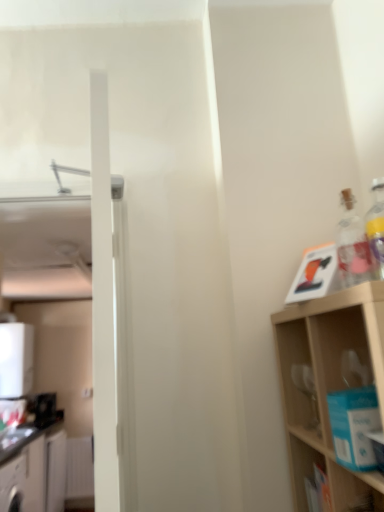
Question: Could black plastic toaster at left, arranged as the first appliance when ordered from the bottom, be considered to be inside wooden shelf at right?

Choices:
 (A) no
 (B) yes

Answer: (A)

Question: Can you confirm if wooden shelf at right is taller than black plastic toaster at left, the second appliance when ordered from top to bottom?

Choices:
 (A) no
 (B) yes

Answer: (B)

Question: From the image's perspective, is wooden shelf at right beneath black plastic toaster at left, the second appliance when ordered from top to bottom?

Choices:
 (A) yes
 (B) no

Answer: (B)

Question: Is wooden shelf at right further to camera compared to black plastic toaster at left, arranged as the first appliance when ordered from the bottom?

Choices:
 (A) no
 (B) yes

Answer: (A)

Question: Is wooden shelf at right shorter than black plastic toaster at left, the second appliance when ordered from top to bottom?

Choices:
 (A) no
 (B) yes

Answer: (A)

Question: Considering the relative sizes of wooden shelf at right and black plastic toaster at left, the second appliance when ordered from top to bottom, in the image provided, is wooden shelf at right thinner than black plastic toaster at left, the second appliance when ordered from top to bottom,?

Choices:
 (A) yes
 (B) no

Answer: (B)

Question: Is transparent glass bottle at upper right not near white glossy cabinet at lower left, the first cabinetry viewed from the front?

Choices:
 (A) yes
 (B) no

Answer: (A)

Question: From the image's perspective, is transparent glass bottle at upper right above white glossy cabinet at lower left, the first cabinetry viewed from the front?

Choices:
 (A) no
 (B) yes

Answer: (B)

Question: From a real-world perspective, does transparent glass bottle at upper right stand above white glossy cabinet at lower left, the first cabinetry viewed from the front?

Choices:
 (A) yes
 (B) no

Answer: (A)

Question: Considering the relative sizes of transparent glass bottle at upper right and white glossy cabinet at lower left, the first cabinetry viewed from the front, in the image provided, is transparent glass bottle at upper right bigger than white glossy cabinet at lower left, the first cabinetry viewed from the front,?

Choices:
 (A) yes
 (B) no

Answer: (B)

Question: Does transparent glass bottle at upper right have a smaller size compared to white glossy cabinet at lower left, which is counted as the second cabinetry, starting from the back?

Choices:
 (A) no
 (B) yes

Answer: (B)

Question: Is transparent glass bottle at upper right positioned before white glossy cabinet at lower left, the first cabinetry viewed from the front?

Choices:
 (A) yes
 (B) no

Answer: (A)

Question: Is black plastic toaster at left, arranged as the first appliance when ordered from the bottom, at the left side of wooden shelf at right?

Choices:
 (A) yes
 (B) no

Answer: (A)